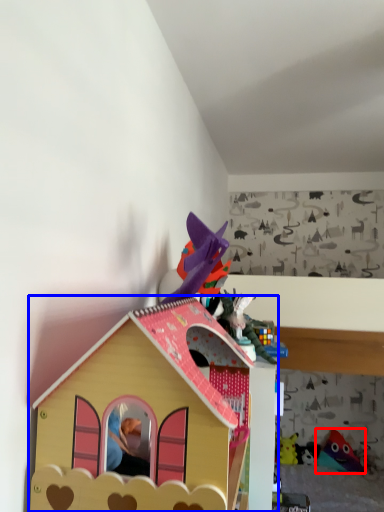
Question: Which of the following is the closest to the observer, toy (highlighted by a red box) or toy (highlighted by a blue box)?

Choices:
 (A) toy
 (B) toy

Answer: (B)